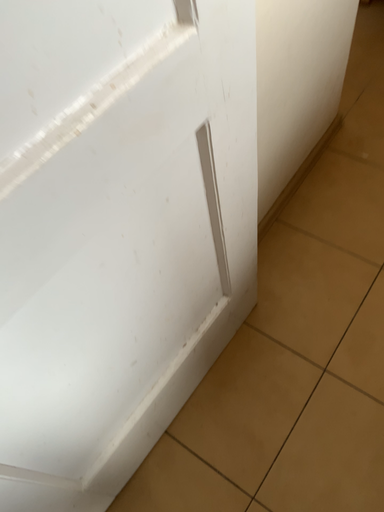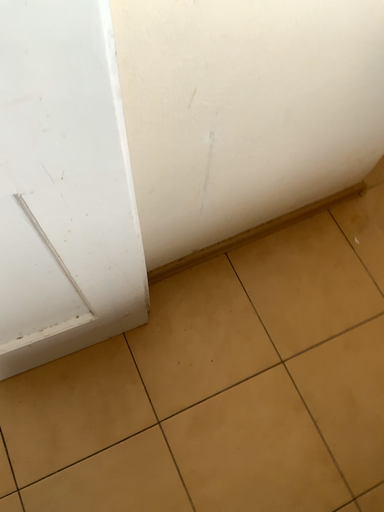
Question: How did the camera likely rotate when shooting the video?

Choices:
 (A) rotated left
 (B) rotated right

Answer: (A)